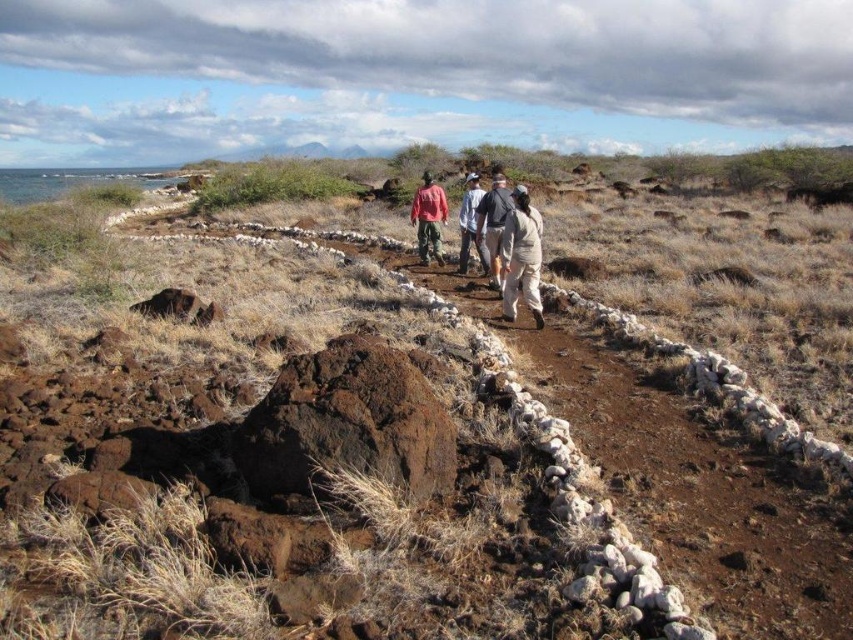
Question: Observing the image, what is the correct spatial positioning of tan fabric pants at center in reference to light gray fabric pants at center?

Choices:
 (A) left
 (B) right

Answer: (B)

Question: Which of the following is the farthest from the observer?

Choices:
 (A) (427, 224)
 (B) (476, 216)

Answer: (A)

Question: Can you confirm if light gray fabric pants at center is positioned below matte red shirt at center?

Choices:
 (A) no
 (B) yes

Answer: (B)

Question: Which of the following is the closest to the observer?

Choices:
 (A) matte red shirt at center
 (B) light gray fabric pants at center
 (C) light beige uniform at center

Answer: (B)

Question: Which of the following is the farthest from the observer?

Choices:
 (A) (444, 218)
 (B) (467, 218)

Answer: (A)

Question: Is matte red shirt at center bigger than light beige uniform at center?

Choices:
 (A) no
 (B) yes

Answer: (A)